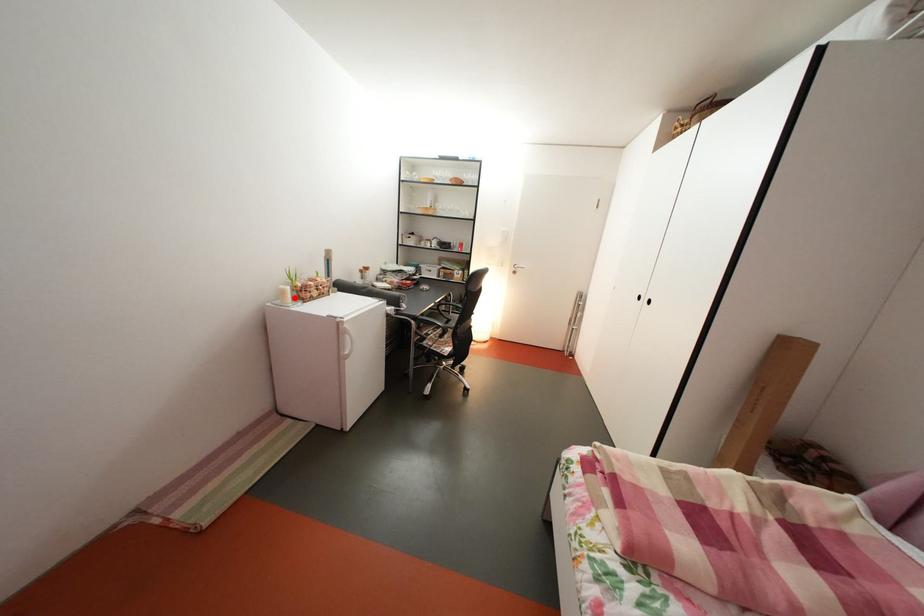
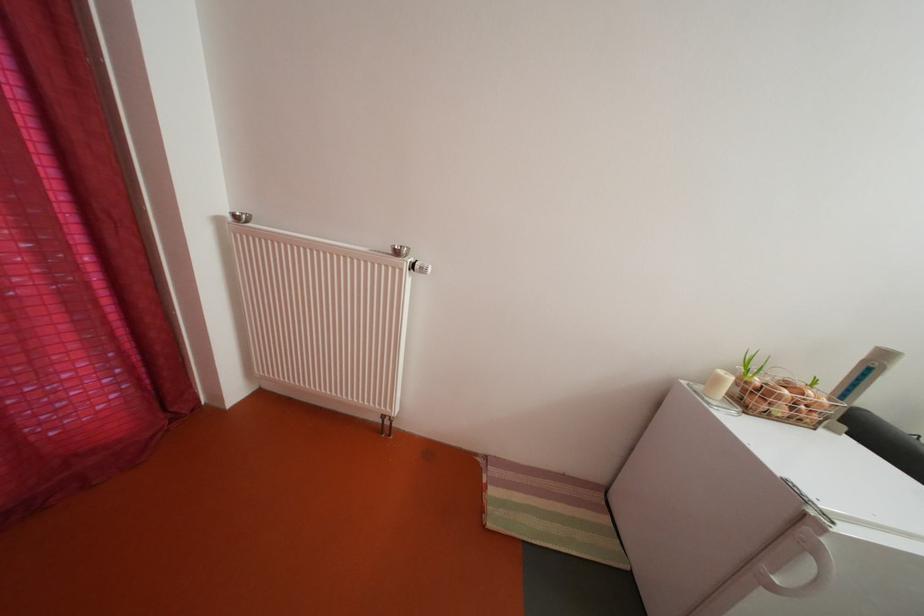
In the second image, find the point that corresponds to the highlighted location in the first image.

(728, 386)